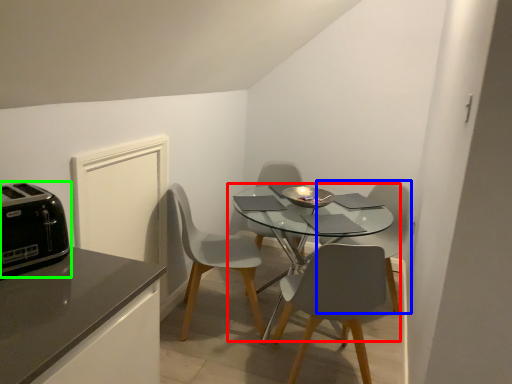
Question: Based on their relative distances, which object is nearer to kitchen & dining room table (highlighted by a red box)? Choose from chair (highlighted by a blue box) and toaster (highlighted by a green box).

Choices:
 (A) chair
 (B) toaster

Answer: (A)